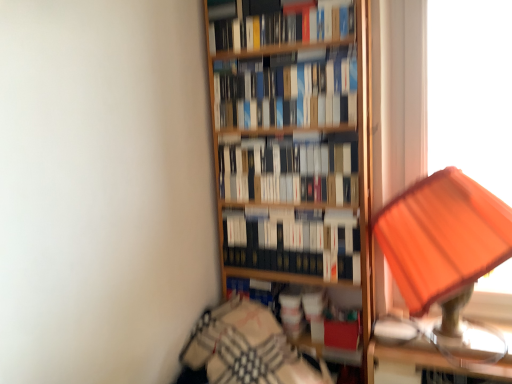
Identify the location of vacant point above metallic gold table at right (from a real-world perspective). (471, 324).